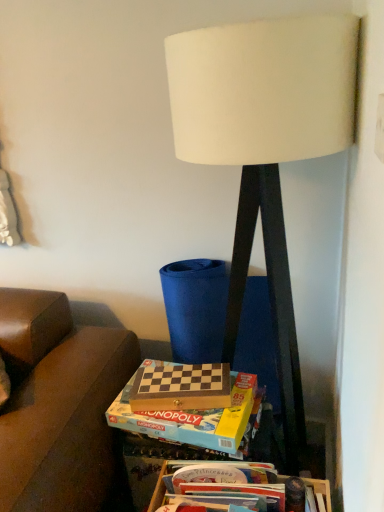
Question: From a real-world perspective, is wooden board game at center positioned above or below white fabric lampshade at center?

Choices:
 (A) below
 (B) above

Answer: (A)

Question: Do you think wooden board game at center is within white fabric lampshade at center, or outside of it?

Choices:
 (A) inside
 (B) outside

Answer: (A)

Question: Which of these objects is positioned closest to the white fabric lampshade at center?

Choices:
 (A) wooden chess set at center, positioned as the 2th box in bottom-to-top order
 (B) wooden board game at center
 (C) wooden chessboard at center
 (D) wooden board game at lower center, which appears as the second box when viewed from the top

Answer: (A)

Question: Estimate the real-world distances between objects in this image. Which object is closer to the wooden board game at lower center, which appears as the second box when viewed from the top?

Choices:
 (A) wooden chess set at center, acting as the first box starting from the top
 (B) wooden board game at center
 (C) white fabric lampshade at center
 (D) wooden chessboard at center

Answer: (A)